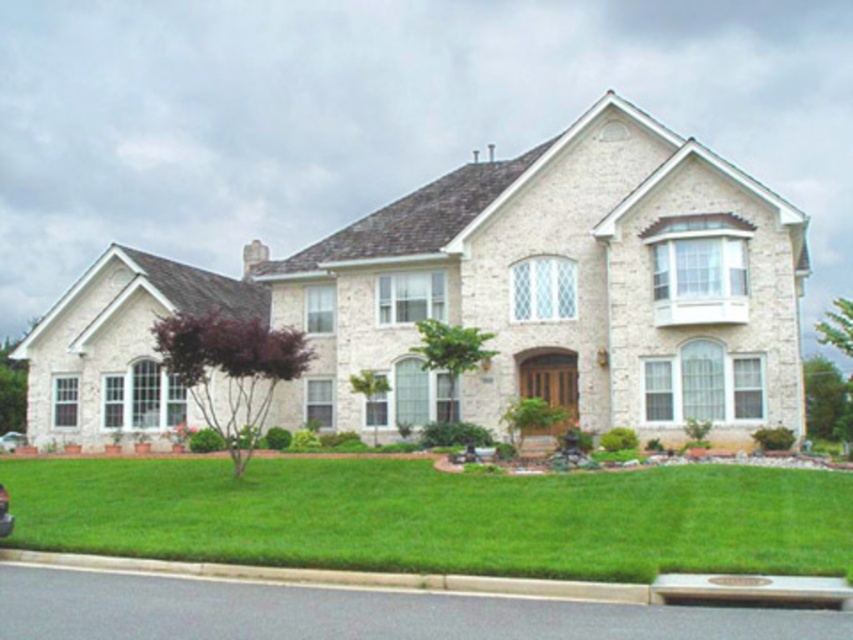
Question: Is green grass at lower center thinner than gray concrete curb at lower center?

Choices:
 (A) yes
 (B) no

Answer: (B)

Question: Is green grass at lower center above gray concrete curb at lower center?

Choices:
 (A) yes
 (B) no

Answer: (A)

Question: Does green grass at lower center appear under gray concrete curb at lower center?

Choices:
 (A) no
 (B) yes

Answer: (A)

Question: Which object is the farthest from the gray concrete curb at lower center?

Choices:
 (A) green grass at lower center
 (B) shiny black car at lower left

Answer: (B)

Question: Which of the following is the farthest from the observer?

Choices:
 (A) (9, 512)
 (B) (802, 544)
 (C) (440, 573)

Answer: (A)

Question: Which point is closer to the camera taking this photo?

Choices:
 (A) (9, 532)
 (B) (332, 476)

Answer: (A)